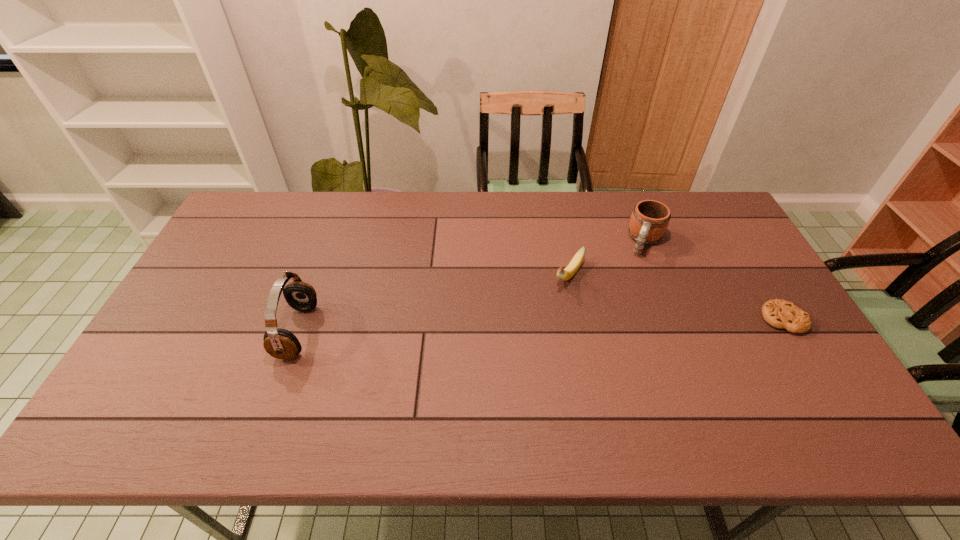
The width and height of the screenshot is (960, 540). Identify the location of free spot at the left edge of the desktop. (256, 264).

You are a GUI agent. You are given a task and a screenshot of the screen. Output one action in this format:
    pyautogui.click(x=<x>, y=<y>)
    Task: Click on the free space between the leftmost object and the banana
    
    Given the screenshot: What is the action you would take?
    pyautogui.click(x=433, y=303)

I want to click on unoccupied position between the cookie and the third tallest object, so click(x=676, y=297).

What are the coordinates of `vacant space that is in between the third shortest object and the second shortest object` in the screenshot? It's located at (607, 258).

Image resolution: width=960 pixels, height=540 pixels. I want to click on vacant area that lies between the banana and the tallest object, so click(433, 303).

Find the location of a particular element. The height and width of the screenshot is (540, 960). blank region between the tallest object and the banana is located at coordinates (433, 303).

The image size is (960, 540). Find the location of `vacant area between the tallest object and the second shortest object`. vacant area between the tallest object and the second shortest object is located at coordinates (433, 303).

I want to click on empty location between the second object from right to left and the third object from right to left, so click(607, 258).

Find the location of `empty space between the tallest object and the second tallest object`. empty space between the tallest object and the second tallest object is located at coordinates (471, 286).

Find the location of a particular element. This screenshot has width=960, height=540. vacant space that's between the shortest object and the third object from left to right is located at coordinates (714, 280).